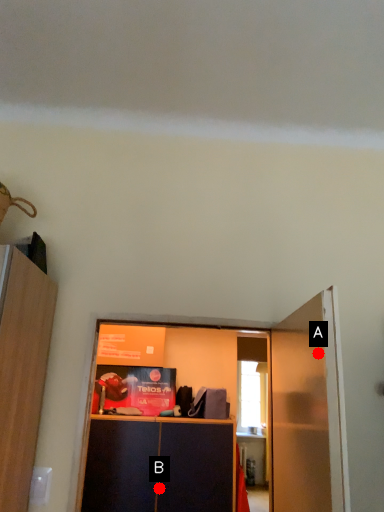
Question: Two points are circled on the image, labeled by A and B beside each circle. Which point appears closest to the camera in this image?

Choices:
 (A) A is closer
 (B) B is closer

Answer: (A)